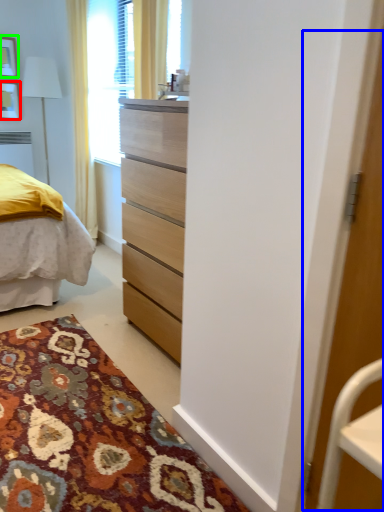
Question: Which object is positioned closest to picture frame (highlighted by a red box)? Select from screen door (highlighted by a blue box) and picture frame (highlighted by a green box).

Choices:
 (A) screen door
 (B) picture frame

Answer: (B)